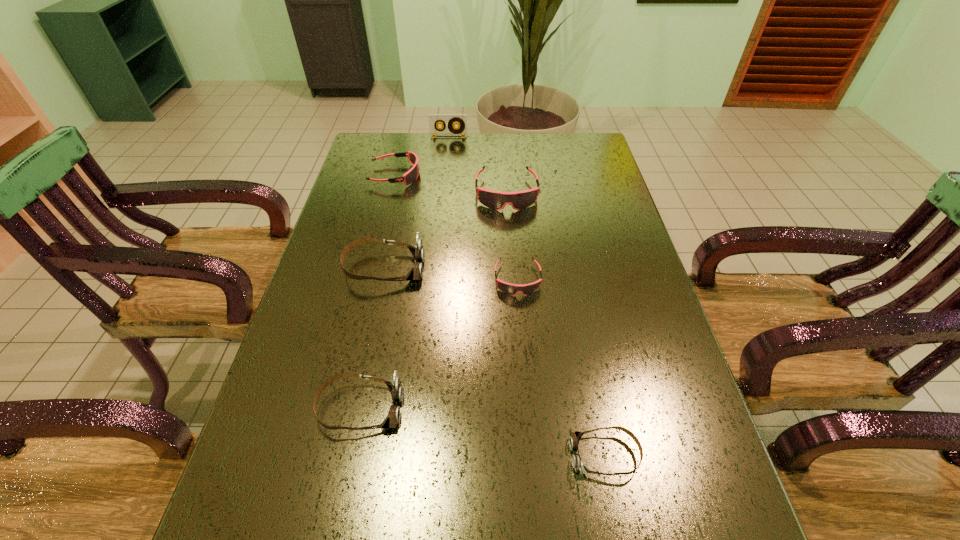
This screenshot has height=540, width=960. What are the coordinates of `free space between the rightmost brown goggles and the farthest brown goggles` in the screenshot? It's located at (494, 362).

I want to click on free space between the smallest brown goggles and the biggest brown goggles, so click(x=494, y=362).

The height and width of the screenshot is (540, 960). What are the coordinates of `unoccupied area between the biggest pink goggles and the leftmost pink goggles` in the screenshot? It's located at (451, 184).

Locate an element on the screen. free space between the biggest pink goggles and the smallest pink goggles is located at coordinates (512, 236).

The height and width of the screenshot is (540, 960). Find the location of `free point between the nearest pink goggles and the second smallest brown goggles`. free point between the nearest pink goggles and the second smallest brown goggles is located at coordinates (439, 343).

The image size is (960, 540). Identify the location of object that is the sixth closest to the smallest pink goggles. (434, 119).

You are a GUI agent. You are given a task and a screenshot of the screen. Output one action in this format:
    pyautogui.click(x=<x>, y=<y>)
    Task: Click on the object that is the fifth nearest to the second smallest brown goggles
    
    Given the screenshot: What is the action you would take?
    pyautogui.click(x=411, y=176)

Locate an element on the screen. The width and height of the screenshot is (960, 540). goggles that is the second closest to the second biggest pink goggles is located at coordinates (416, 273).

You are a GUI agent. You are given a task and a screenshot of the screen. Output one action in this format:
    pyautogui.click(x=<x>, y=<y>)
    Task: Click on the goggles that is the fourth closest one to the rightmost brown goggles
    This screenshot has width=960, height=540.
    Given the screenshot: What is the action you would take?
    pyautogui.click(x=495, y=200)

Identify which pink goggles is the nearest to the biggest pink goggles. Please provide its 2D coordinates. Your answer should be formatted as a tuple, i.e. [(x, y)], where the tuple contains the x and y coordinates of a point satisfying the conditions above.

[(411, 176)]